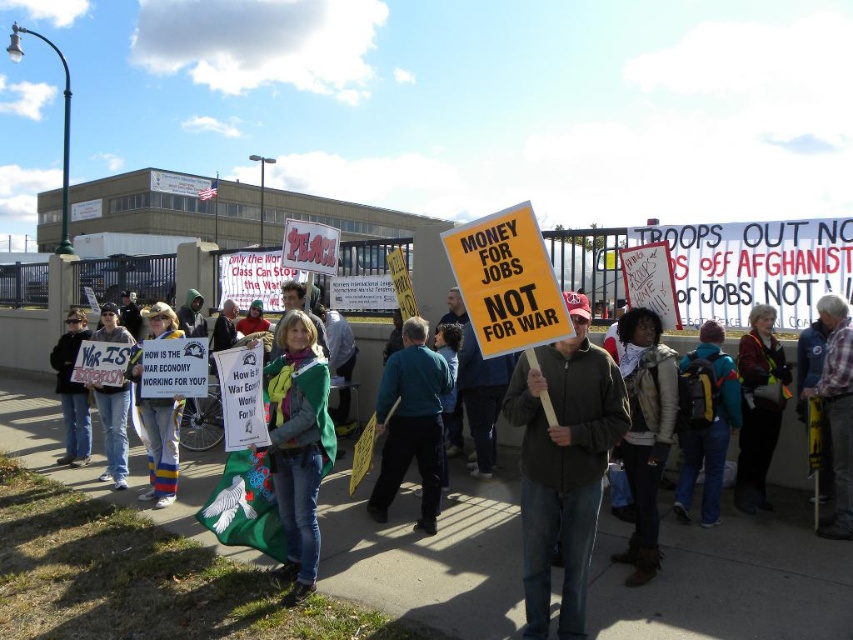
Is point (338, 538) positioned after point (701, 461)?

That is False.

Which is above, green fabric flag at center or teal fabric jacket at center?

Positioned higher is teal fabric jacket at center.

Is point (605, 518) in front of point (694, 413)?

No, it is not.

The image size is (853, 640). I want to click on green fabric flag at center, so click(x=726, y=582).

Based on the photo, can you confirm if matte yellow sign at center is thinner than maroon fabric jacket at center?

Incorrect, matte yellow sign at center's width is not less than maroon fabric jacket at center's.

Locate an element on the screen. This screenshot has height=640, width=853. matte yellow sign at center is located at coordinates (563, 465).

Identify the location of matte yellow sign at center. (563, 465).

From the picture: Is maroon fabric jacket at center smaller than knitted wool hat at center?

Correct, maroon fabric jacket at center occupies less space than knitted wool hat at center.

Is point (758, 465) less distant than point (155, 476)?

That is True.

Locate an element on the screen. The image size is (853, 640). maroon fabric jacket at center is located at coordinates (758, 406).